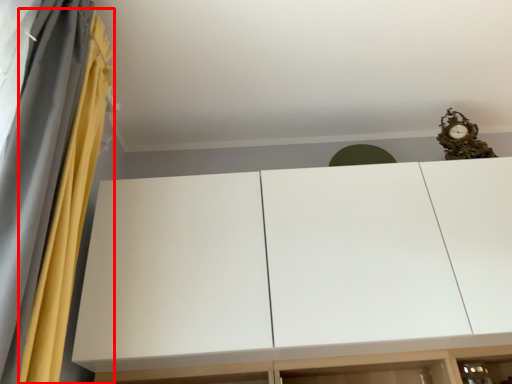
Question: From the image's perspective, what is the correct spatial relationship of curtain (annotated by the red box) in relation to cupboard?

Choices:
 (A) above
 (B) below

Answer: (A)